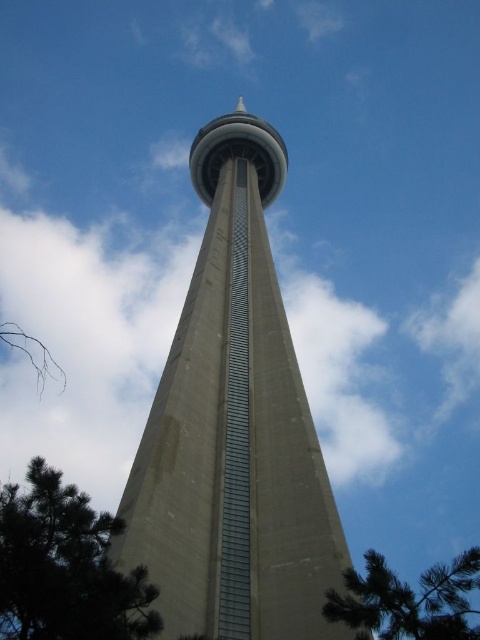
Question: Where is green leafy tree at lower left located in relation to green leafy tree at lower right in the image?

Choices:
 (A) right
 (B) left

Answer: (B)

Question: Among these objects, which one is farthest from the camera?

Choices:
 (A) green leafy tree at lower right
 (B) concrete tower at center

Answer: (B)

Question: Does concrete tower at center appear on the left side of green leafy tree at lower right?

Choices:
 (A) yes
 (B) no

Answer: (A)

Question: Can you confirm if green leafy tree at lower left is smaller than green leafy tree at lower right?

Choices:
 (A) yes
 (B) no

Answer: (A)

Question: Among these points, which one is farthest from the camera?

Choices:
 (A) (80, 524)
 (B) (211, 172)

Answer: (B)

Question: Which of these objects is positioned farthest from the green leafy tree at lower left?

Choices:
 (A) green leafy tree at lower right
 (B) concrete tower at center

Answer: (B)